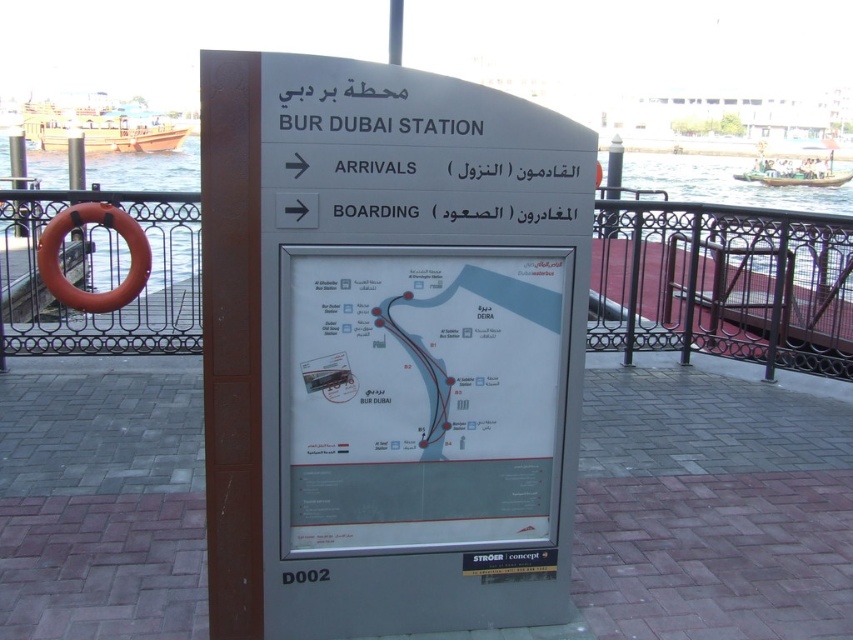
Question: Which point is farther from the camera taking this photo?

Choices:
 (A) (508, 257)
 (B) (612, 312)

Answer: (B)

Question: Observing the image, what is the correct spatial positioning of transparent water at left in reference to orange rubber ring at left?

Choices:
 (A) above
 (B) below

Answer: (A)

Question: Is white paper map at center in front of black metal railing at right?

Choices:
 (A) yes
 (B) no

Answer: (A)

Question: Which point appears closest to the camera in this image?

Choices:
 (A) (131, 208)
 (B) (273, 205)
 (C) (704, 346)
 (D) (113, 204)

Answer: (B)

Question: Which of the following is the closest to the observer?

Choices:
 (A) 131,212
 (B) 637,276
 (C) 341,388

Answer: (C)

Question: Does white paper map at center lie behind orange rubber ring at left?

Choices:
 (A) yes
 (B) no

Answer: (B)